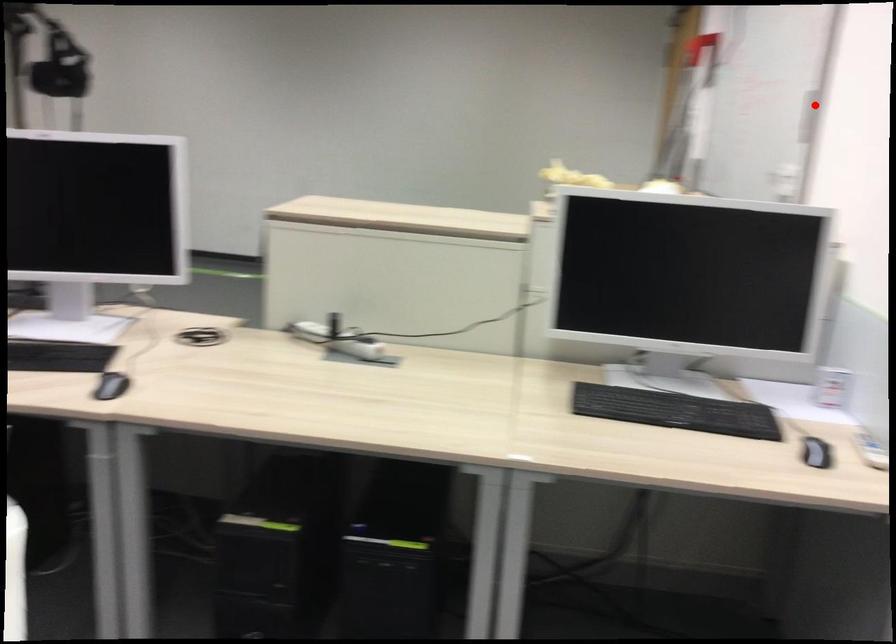
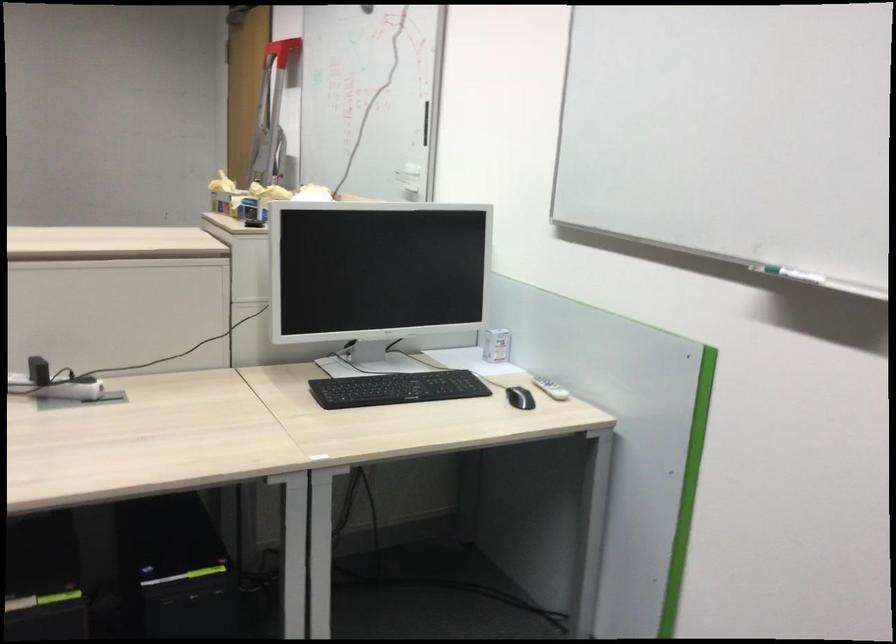
The point at the highlighted location is marked in the first image. Where is the corresponding point in the second image?

(426, 122)